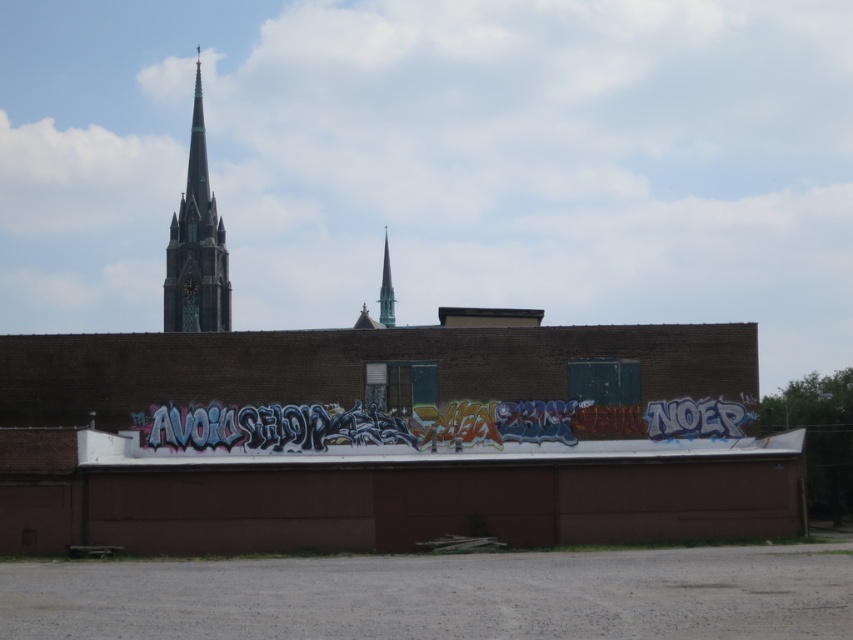
Is multicolored graffiti at center smaller than dark green glass spire at upper left?

Correct, multicolored graffiti at center occupies less space than dark green glass spire at upper left.

Can you confirm if multicolored graffiti at center is positioned below dark green glass spire at upper left?

Correct, multicolored graffiti at center is located below dark green glass spire at upper left.

Who is more distant from viewer, (364, 424) or (202, 220)?

Positioned behind is point (202, 220).

At what (x,y) coordinates should I click in order to perform the action: click on multicolored graffiti at center. Please return your answer as a coordinate pair (x, y). The image size is (853, 640). Looking at the image, I should click on (427, 424).

Between point (335, 433) and point (387, 305), which one is positioned behind?

The point (387, 305) is behind.

Measure the distance between point (177, 406) and camera.

A distance of 57.81 meters exists between point (177, 406) and camera.

I want to click on multicolored graffiti at center, so click(427, 424).

Is dark green glass spire at upper left to the right of smooth glass spire at center from the viewer's perspective?

No, dark green glass spire at upper left is not to the right of smooth glass spire at center.

Does point (190, 218) come behind point (384, 260)?

That is False.

At what (x,y) coordinates should I click in order to perform the action: click on dark green glass spire at upper left. Please return your answer as a coordinate pair (x, y). The height and width of the screenshot is (640, 853). Looking at the image, I should click on (196, 244).